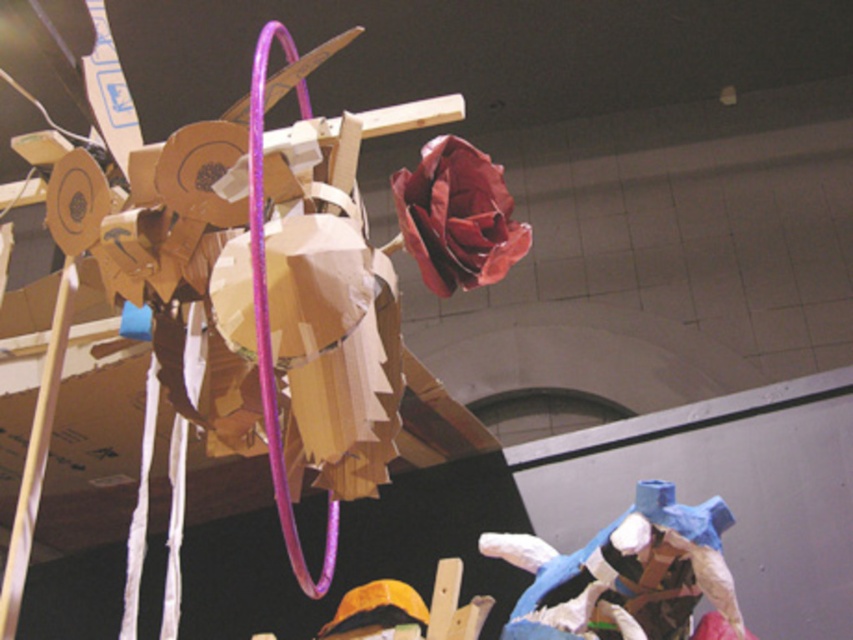
Based on the scene description, where is the blue paper mache figure at lower right located in terms of coordinates?

The blue paper mache figure at lower right is located at point (628, 576).

You are an art curator planning to move the blue paper mache figure at lower right and the matte paper rose at upper center to a new exhibition space. Based on their positions in the current installation, which object is located on the right side of the other?

The blue paper mache figure at lower right is to the right of matte paper rose at upper center, so the blue paper mache figure at lower right is on the right side of the matte paper rose at upper center.

You are an artist standing in front of the art installation. You want to place a new sculpture between the blue paper mache figure at lower right and the matte paper rose at upper center. Can you fit a sculpture that is 3 feet long horizontally between them?

The distance between the blue paper mache figure at lower right and the matte paper rose at upper center is 3.28 feet. Since the sculpture is 3 feet long, it can fit between them as there is enough space.